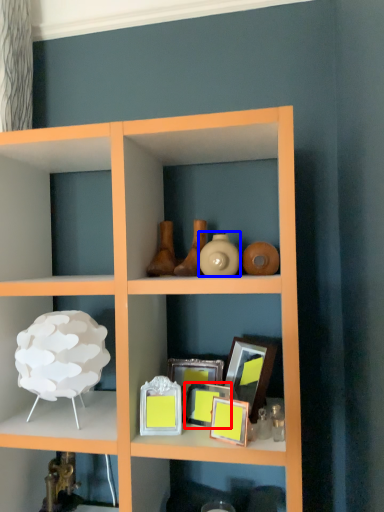
Question: Among these objects, which one is farthest to the camera, picture frame (highlighted by a red box) or vase (highlighted by a blue box)?

Choices:
 (A) picture frame
 (B) vase

Answer: (A)